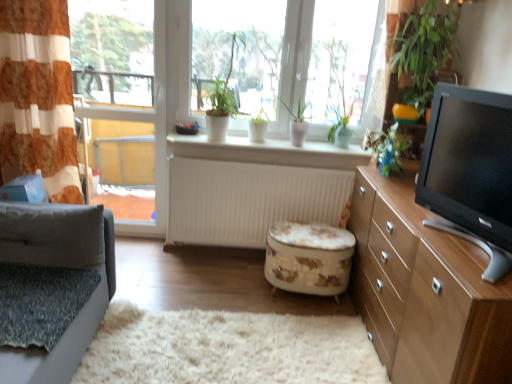
Identify the location of free point to the left of floral-patterned fabric ottoman at center. This screenshot has width=512, height=384. (236, 290).